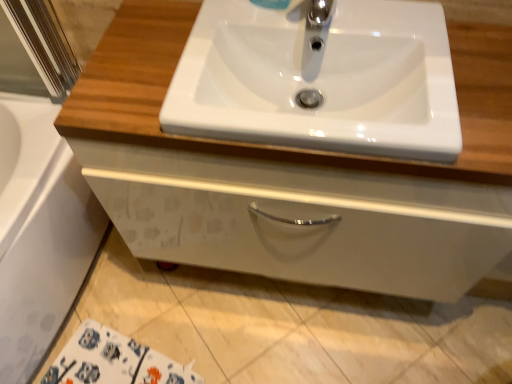
Question: Is chrome metallic faucet at upper center closer to camera compared to white glossy cabinet at center?

Choices:
 (A) no
 (B) yes

Answer: (A)

Question: Does chrome metallic faucet at upper center have a greater width compared to white glossy cabinet at center?

Choices:
 (A) no
 (B) yes

Answer: (A)

Question: Can you confirm if chrome metallic faucet at upper center is taller than white glossy cabinet at center?

Choices:
 (A) no
 (B) yes

Answer: (A)

Question: Is chrome metallic faucet at upper center surrounding white glossy cabinet at center?

Choices:
 (A) yes
 (B) no

Answer: (B)

Question: From the image's perspective, is chrome metallic faucet at upper center located above white glossy cabinet at center?

Choices:
 (A) no
 (B) yes

Answer: (B)

Question: Choose the correct answer: Is chrome metallic faucet at upper center inside white glossy sink at center or outside it?

Choices:
 (A) inside
 (B) outside

Answer: (B)

Question: Based on their positions, is chrome metallic faucet at upper center located to the left or right of white glossy sink at center?

Choices:
 (A) right
 (B) left

Answer: (A)

Question: Considering the positions of chrome metallic faucet at upper center and white glossy sink at center in the image, is chrome metallic faucet at upper center wider or thinner than white glossy sink at center?

Choices:
 (A) thin
 (B) wide

Answer: (A)

Question: In the image, is chrome metallic faucet at upper center positioned in front of or behind white glossy sink at center?

Choices:
 (A) behind
 (B) front

Answer: (A)

Question: Would you say white glossy sink at center is inside or outside chrome metallic faucet at upper center?

Choices:
 (A) inside
 (B) outside

Answer: (B)

Question: Is white glossy sink at center to the left or to the right of chrome metallic faucet at upper center in the image?

Choices:
 (A) right
 (B) left

Answer: (B)

Question: From a real-world perspective, is white glossy sink at center positioned above or below chrome metallic faucet at upper center?

Choices:
 (A) above
 (B) below

Answer: (B)

Question: Is white glossy sink at center in front of or behind chrome metallic faucet at upper center in the image?

Choices:
 (A) behind
 (B) front

Answer: (B)

Question: Is point (316, 168) closer or farther from the camera than point (54, 256)?

Choices:
 (A) farther
 (B) closer

Answer: (B)

Question: Is white glossy cabinet at center inside the boundaries of white glossy bath at lower left, or outside?

Choices:
 (A) outside
 (B) inside

Answer: (A)